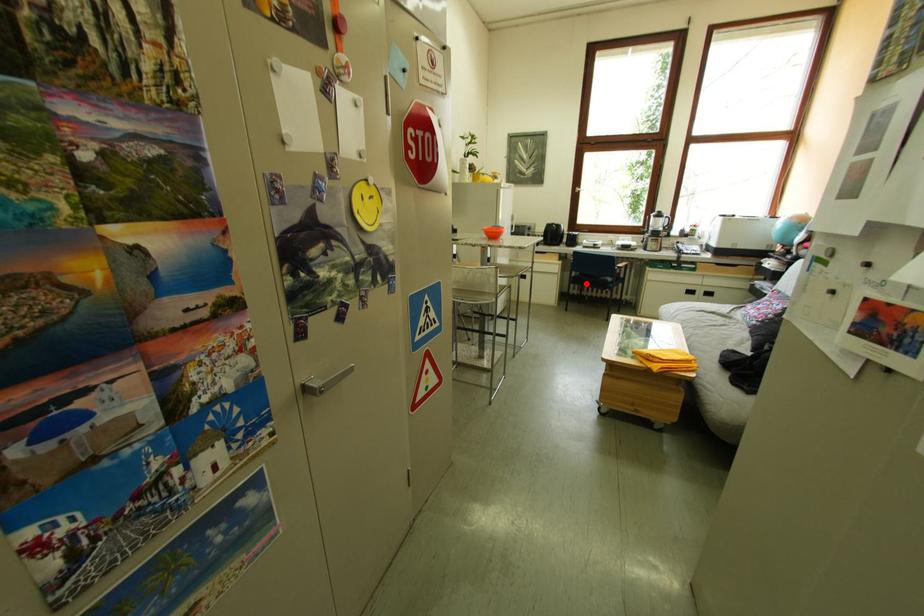
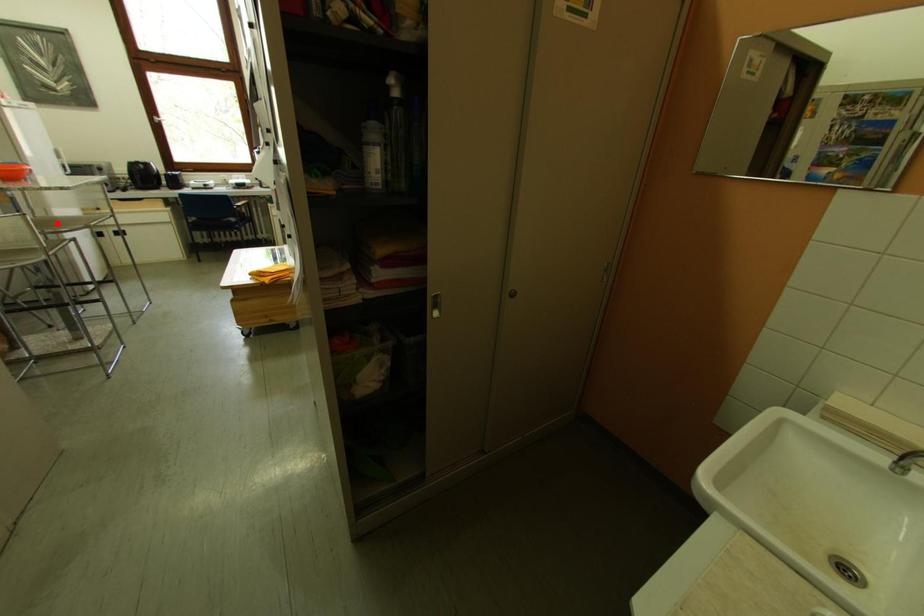
I am providing you with two images of the same scene from different viewpoints. A red point is marked on the first image and another point is marked on the second image. Is the red point in image1 aligned with the point shown in image2?

No